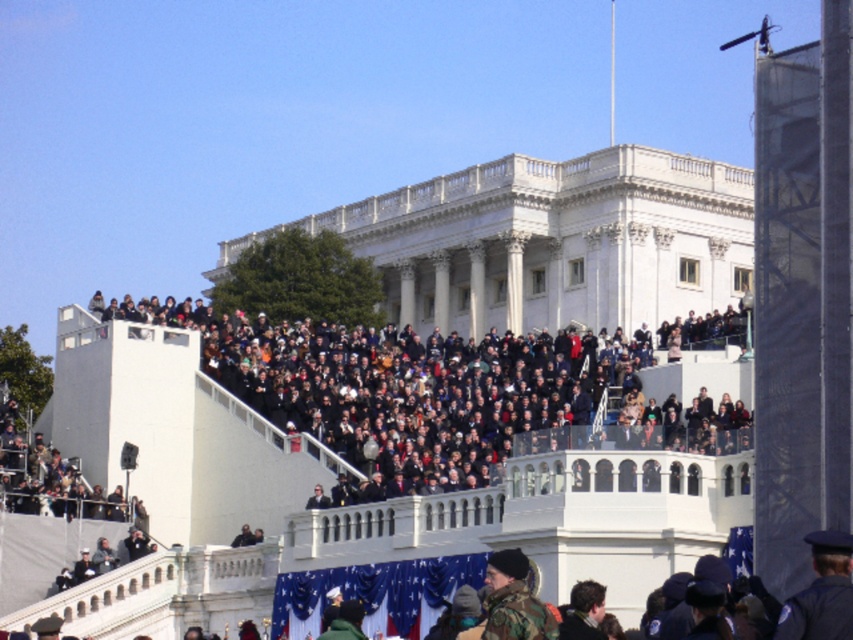
Question: Which object appears closest to the camera in this image?

Choices:
 (A) dark gray concrete crowd at upper center
 (B) camouflage jacket at lower center

Answer: (B)

Question: Does dark blue uniform at lower right have a greater width compared to camouflage jacket at lower center?

Choices:
 (A) no
 (B) yes

Answer: (A)

Question: Can you confirm if dark gray concrete crowd at upper center is positioned to the left of camouflage jacket at lower center?

Choices:
 (A) no
 (B) yes

Answer: (B)

Question: Which object is closer to the camera taking this photo?

Choices:
 (A) dark gray concrete crowd at upper center
 (B) dark blue uniform at lower right

Answer: (B)

Question: Based on their relative distances, which object is nearer to the dark blue uniform at lower right?

Choices:
 (A) dark gray concrete crowd at upper center
 (B) camouflage jacket at lower center

Answer: (B)

Question: Considering the relative positions of dark gray concrete crowd at upper center and camouflage jacket at lower center in the image provided, where is dark gray concrete crowd at upper center located with respect to camouflage jacket at lower center?

Choices:
 (A) right
 (B) left

Answer: (B)